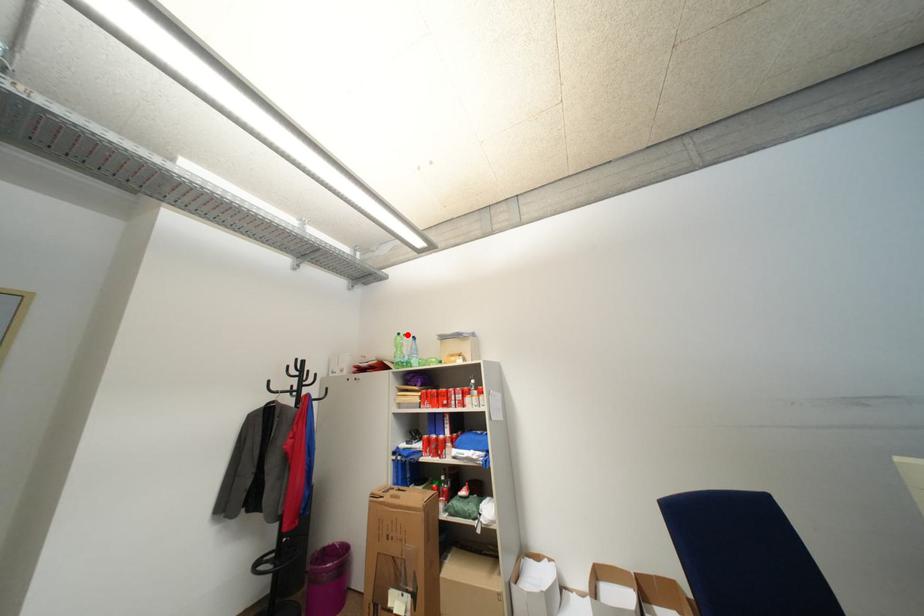
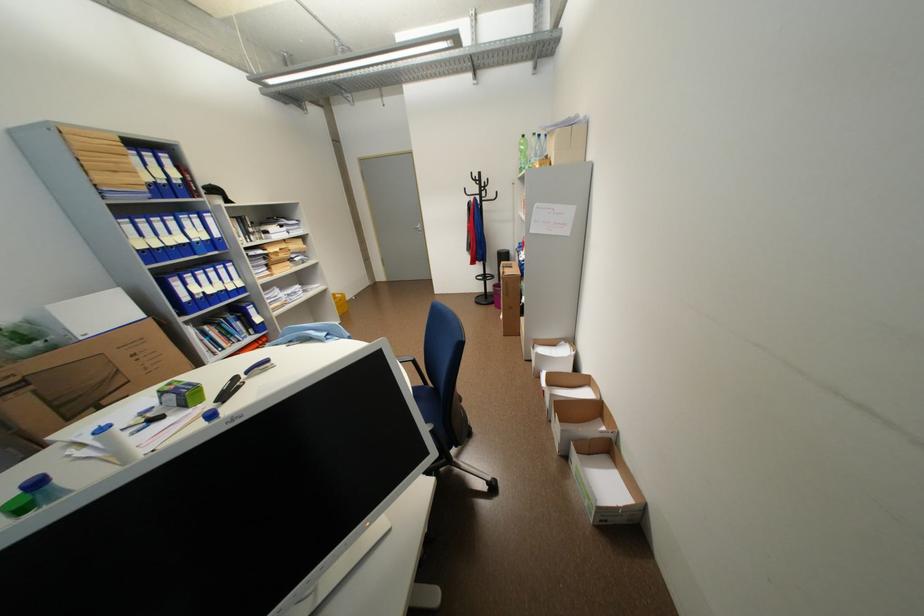
Where in the second image is the point corresponding to the highlighted location from the first image?

(531, 137)